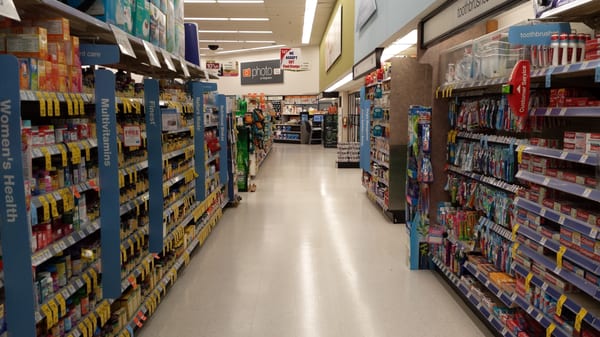
Image resolution: width=600 pixels, height=337 pixels. What are the coordinates of `floor` in the screenshot? It's located at (297, 256), (297, 193).